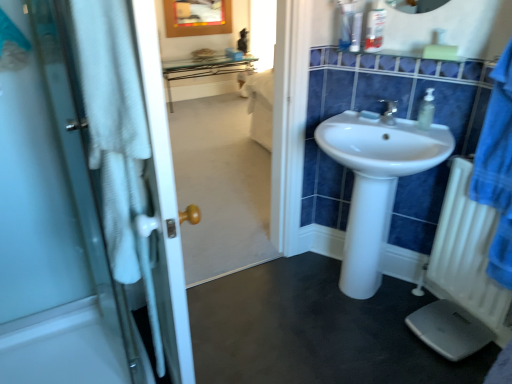
At what (x,y) coordinates should I click in order to perform the action: click on free space that is in between white plastic scale at lower right and white glossy sink at center. Please return your answer as a coordinate pair (x, y). Looking at the image, I should click on (406, 331).